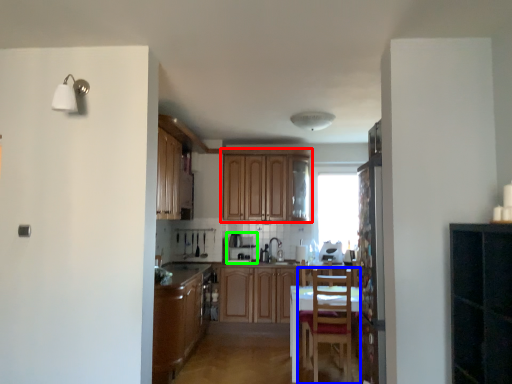
Question: Which is nearer to the cabinetry (highlighted by a red box)? chair (highlighted by a blue box) or appliance (highlighted by a green box).

Choices:
 (A) chair
 (B) appliance

Answer: (B)